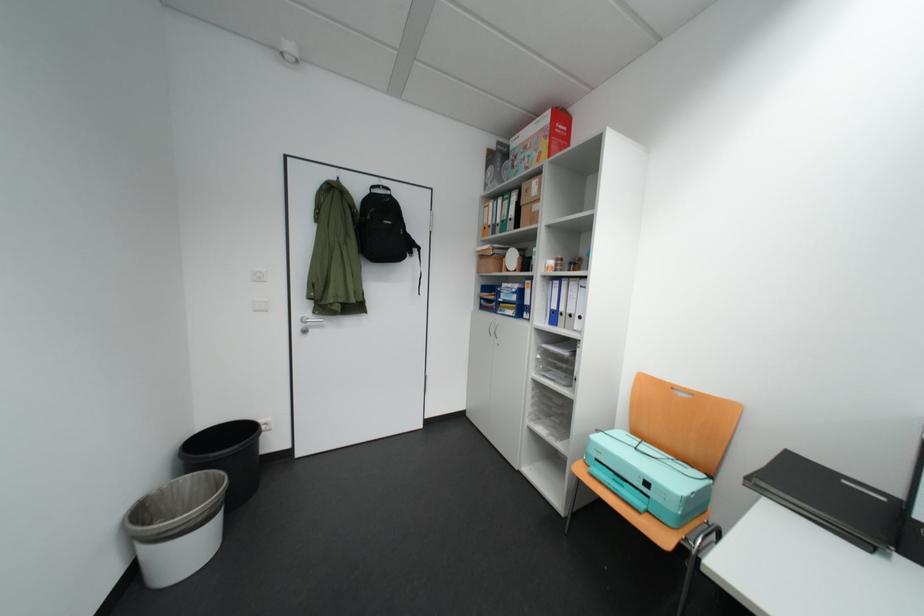
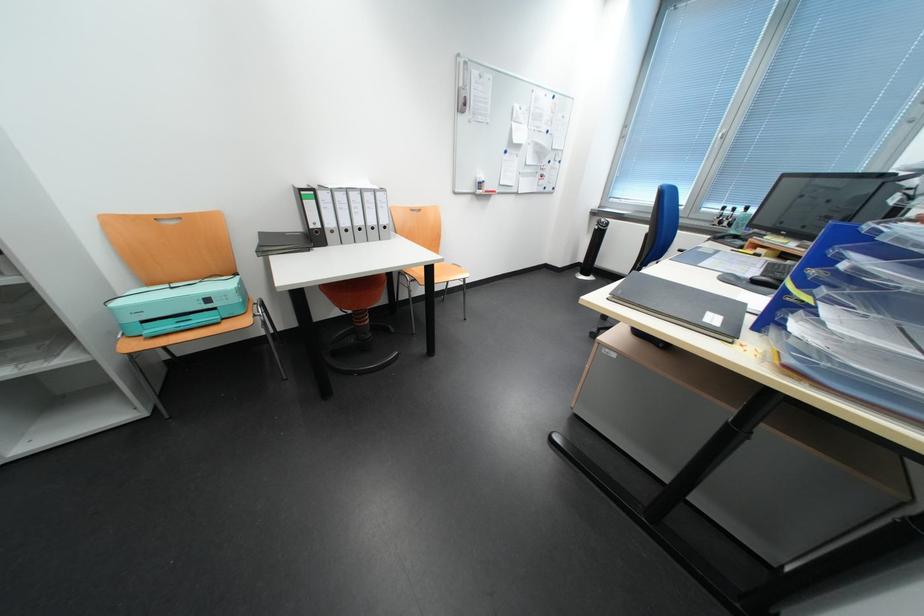
Based on the continuous images, in which direction is the camera rotating?

The camera rotated toward right-down.